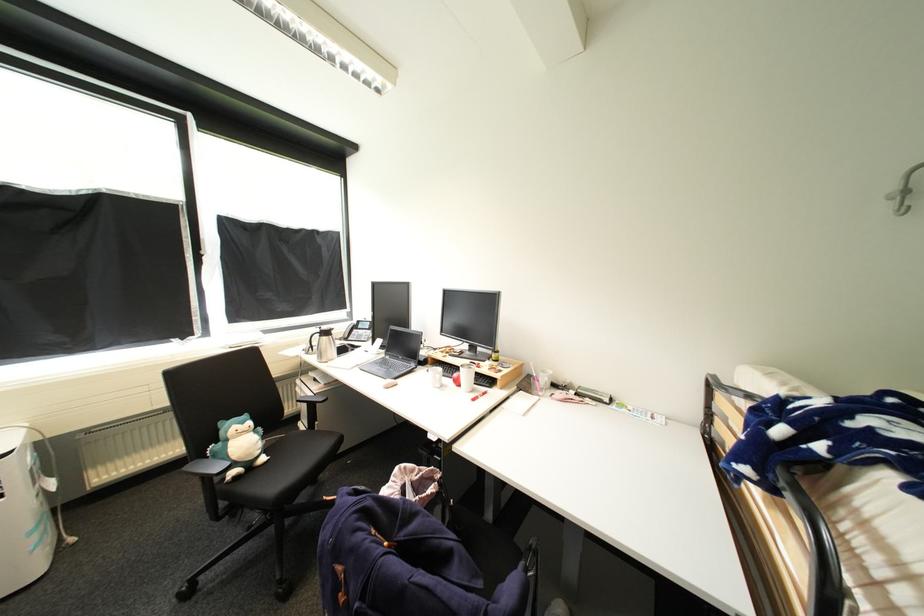
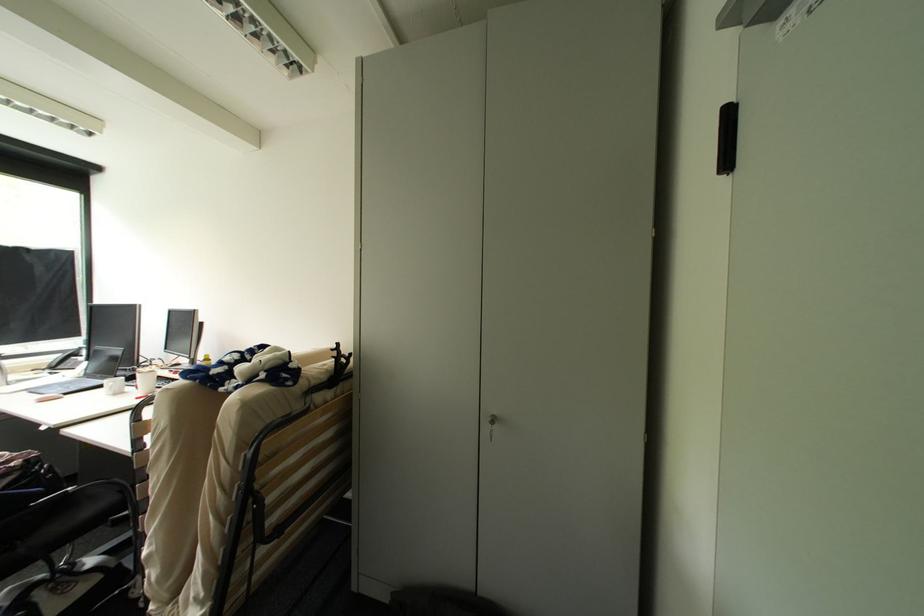
What movement of the cameraman would produce the second image?

The cameraman moved toward right, backward.